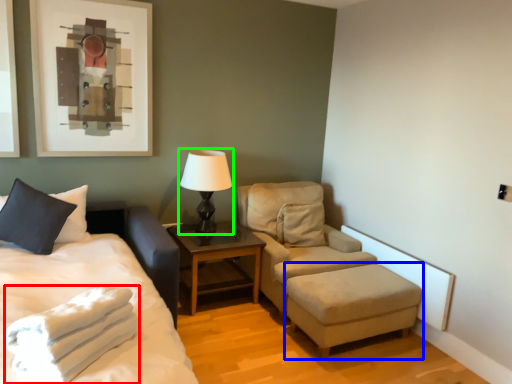
Question: Which object is positioned farthest from blanket (highlighted by a red box)? Select from stool (highlighted by a blue box) and table lamp (highlighted by a green box).

Choices:
 (A) stool
 (B) table lamp

Answer: (B)